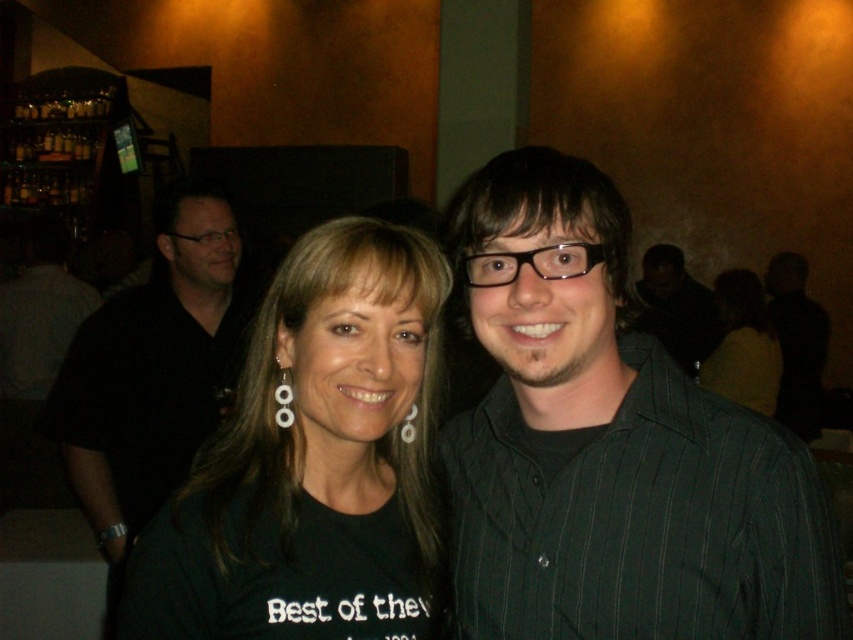
You are a photographer trying to capture a clear shot of the green striped shirt at center and the white pearl earring at upper center. Based on their positions, which object is more likely to be in focus if you focus on the center of the image?

The green striped shirt at center is more likely to be in focus because it is positioned at the center of the image, which is the focus point.

You are taking a photo of two people standing in a social setting. You want to focus on the person closer to the camera. Which point should you focus on, point (576, 198) or point (405, 417)?

Point (576, 198) is closer to the camera than point (405, 417), so you should focus on point (576, 198) to capture the person closer to the camera.